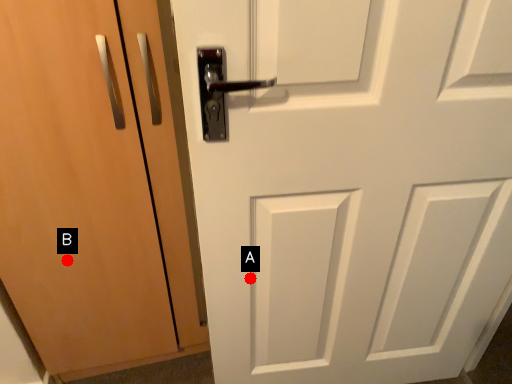
Question: Two points are circled on the image, labeled by A and B beside each circle. Which point is further to the camera?

Choices:
 (A) A is further
 (B) B is further

Answer: (B)